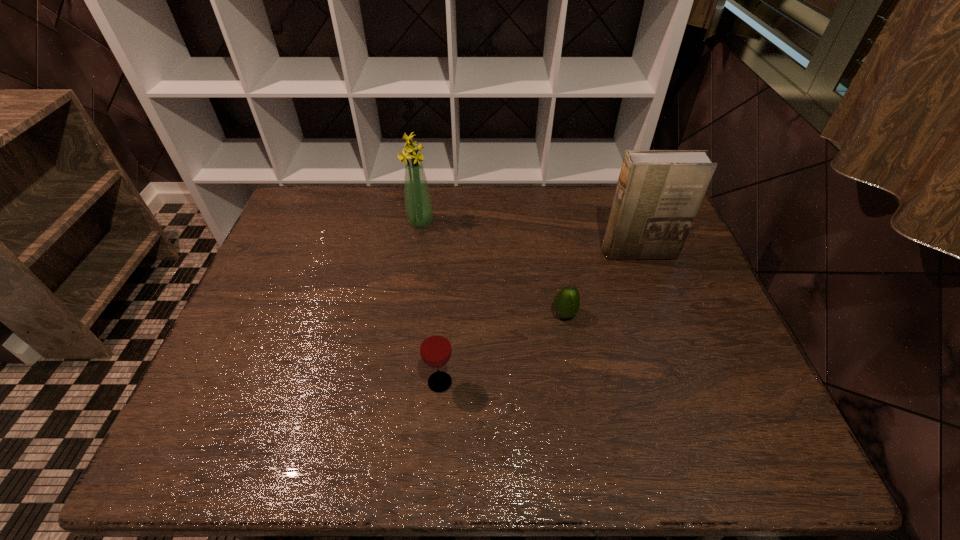
Locate an element on the screen. Image resolution: width=960 pixels, height=540 pixels. vacant space situated 0.190m on the left of the nearest object is located at coordinates (345, 382).

Where is `free space located on the front of the avocado`? This screenshot has height=540, width=960. free space located on the front of the avocado is located at coordinates (574, 371).

Image resolution: width=960 pixels, height=540 pixels. I want to click on object that is at the far edge, so click(x=418, y=204).

You are a GUI agent. You are given a task and a screenshot of the screen. Output one action in this format:
    pyautogui.click(x=<x>, y=<y>)
    Task: Click on the object positioned at the right edge
    This screenshot has height=540, width=960.
    Given the screenshot: What is the action you would take?
    pyautogui.click(x=658, y=194)

This screenshot has height=540, width=960. In the image, there is a desktop. What are the coordinates of `vacant space at the far edge` in the screenshot? It's located at (380, 225).

The image size is (960, 540). Identify the location of free region at the near edge. (293, 435).

The height and width of the screenshot is (540, 960). What are the coordinates of `free space at the right edge of the desktop` in the screenshot? It's located at (694, 281).

At what (x,y) coordinates should I click in order to perform the action: click on free space between the leftmost object and the second shortest object. Please return your answer as a coordinate pair (x, y). Looking at the image, I should click on (430, 302).

I want to click on empty space that is in between the farthest object and the glass, so click(x=430, y=302).

Find the location of a particular element. vacant point located between the shortest object and the third nearest object is located at coordinates (601, 284).